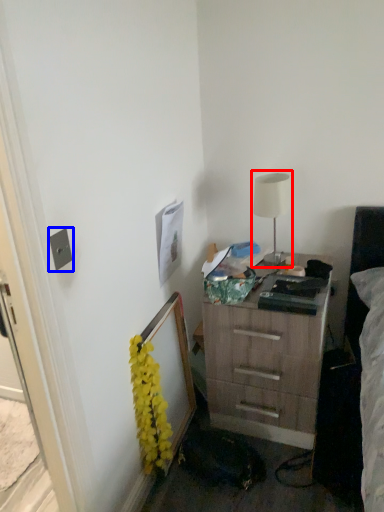
Question: Which point is closer to the camera, table lamp (highlighted by a red box) or electric outlet (highlighted by a blue box)?

Choices:
 (A) table lamp
 (B) electric outlet

Answer: (B)